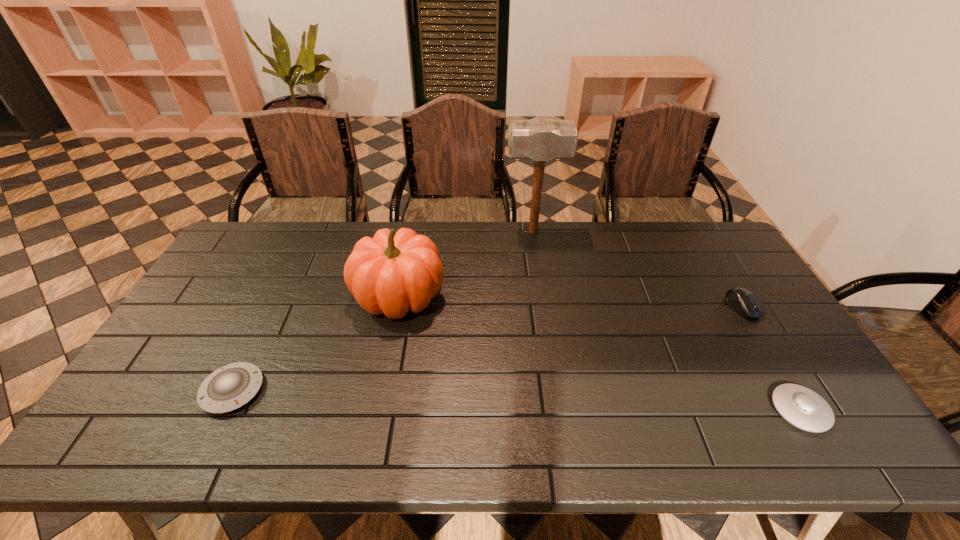
In the image, there is a desktop. Where is `blank space at the near edge`? This screenshot has height=540, width=960. blank space at the near edge is located at coordinates (523, 447).

This screenshot has width=960, height=540. In the image, there is a desktop. Identify the location of vacant space at the left edge. (244, 292).

Image resolution: width=960 pixels, height=540 pixels. What are the coordinates of `blank space at the right edge` in the screenshot? It's located at (744, 275).

You are a GUI agent. You are given a task and a screenshot of the screen. Output one action in this format:
    pyautogui.click(x=<x>, y=<y>)
    Task: Click on the vacant space at the far left corner
    This screenshot has height=540, width=960.
    Given the screenshot: What is the action you would take?
    pyautogui.click(x=285, y=222)

Where is `free space at the far right corner of the desktop`? free space at the far right corner of the desktop is located at coordinates (701, 258).

Where is `vacant area that lies between the mouse and the fourth shortest object`? The height and width of the screenshot is (540, 960). vacant area that lies between the mouse and the fourth shortest object is located at coordinates click(570, 301).

What are the coordinates of `free space between the right saucer and the tallest object` in the screenshot? It's located at (666, 321).

Locate an element on the screen. free space that is in between the leftmost object and the right saucer is located at coordinates (516, 400).

At what (x,y) coordinates should I click in order to perform the action: click on vacant region between the mouse and the third object from left to right. Please return your answer as a coordinate pair (x, y). This screenshot has width=960, height=540. Looking at the image, I should click on (637, 270).

This screenshot has width=960, height=540. What are the coordinates of `vacant space that's between the leftmost object and the mouse` in the screenshot? It's located at (488, 349).